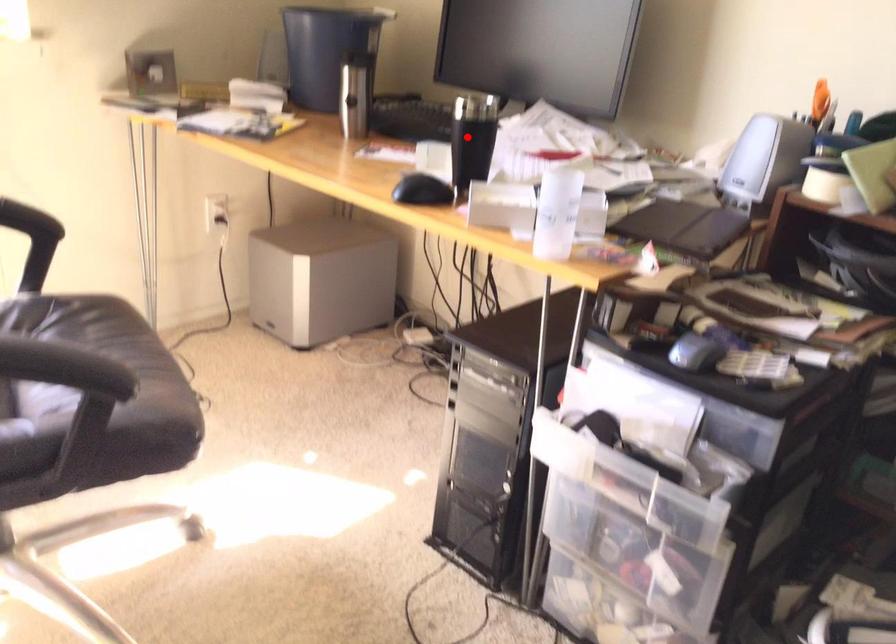
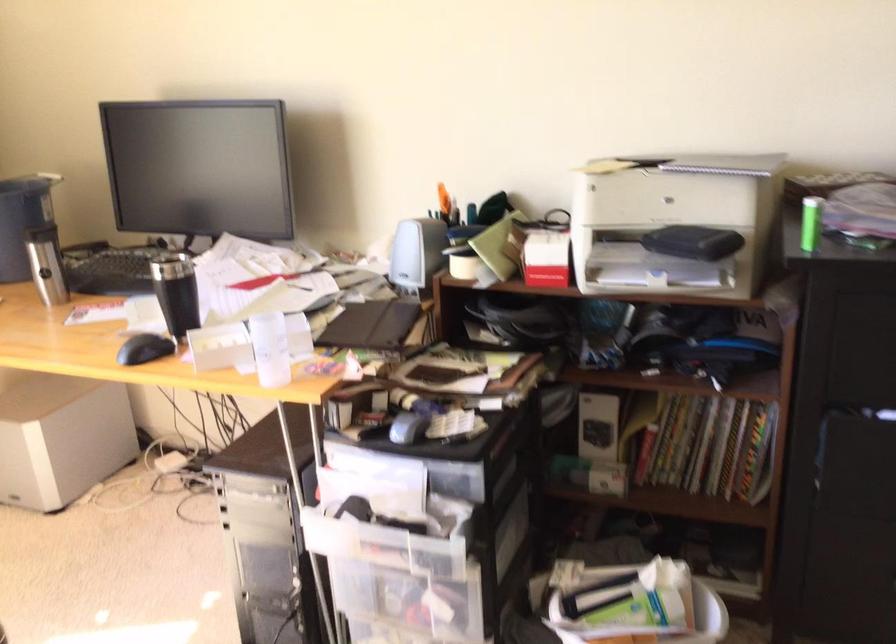
Question: I am providing you with two images of the same scene from different viewpoints. Image1 has a red point marked. In image2, the corresponding 3D location appears at what relative position? Reply with the corresponding letter.

Choices:
 (A) Closer
 (B) Farther

Answer: (B)